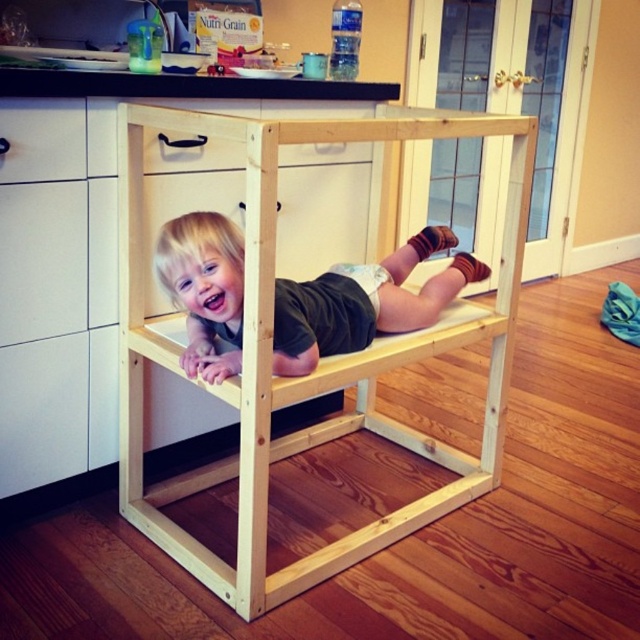
Question: Among these objects, which one is nearest to the camera?

Choices:
 (A) matte black toddler at center
 (B) white matte drawer at upper left

Answer: (A)

Question: Estimate the real-world distances between objects in this image. Which object is closer to the matte black toddler at center?

Choices:
 (A) natural wood step stool at center
 (B) white matte drawer at upper left

Answer: (A)

Question: Can you confirm if natural wood step stool at center is thinner than white matte drawer at upper left?

Choices:
 (A) yes
 (B) no

Answer: (B)

Question: Is matte black toddler at center closer to the viewer compared to white matte drawer at upper left?

Choices:
 (A) no
 (B) yes

Answer: (B)

Question: Considering the real-world distances, which object is closest to the white matte drawer at upper left?

Choices:
 (A) natural wood step stool at center
 (B) matte black toddler at center

Answer: (B)

Question: In this image, where is matte black toddler at center located relative to white matte drawer at upper left?

Choices:
 (A) right
 (B) left

Answer: (A)